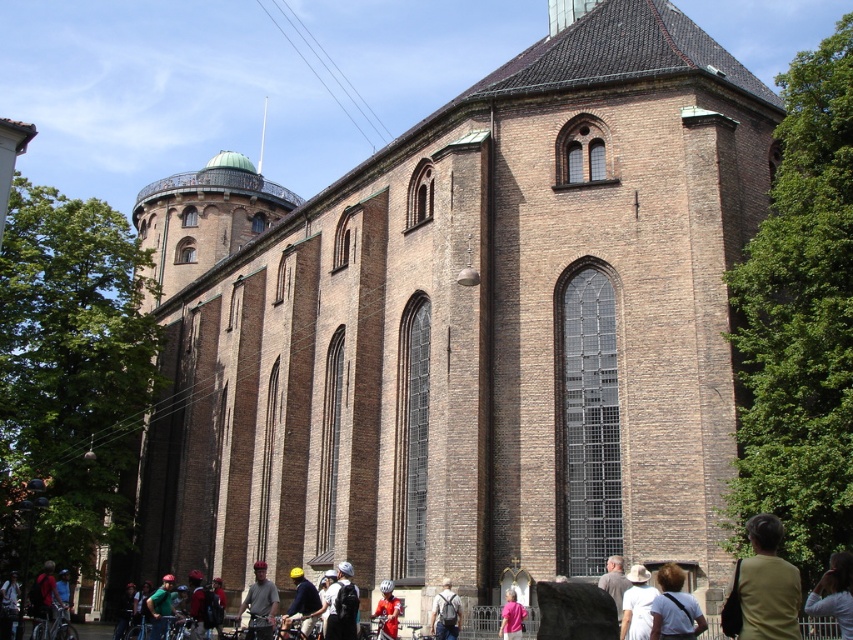
You are standing at the entrance of the historic brick building and want to take a photo of the gray cotton shirt at center. Where should you position yourself to capture the shirt in the frame?

The gray cotton shirt at center is located at point 0.945 on the x axis and 0.305 on the y axis, so you should position yourself to aim your camera towards those coordinates to capture the shirt in the frame.

You are standing in front of the historic brick building and notice a point marked at coordinates (767, 584). Which object is located at this point?

The point at coordinates (767, 584) marks the green fabric shirt at lower right.